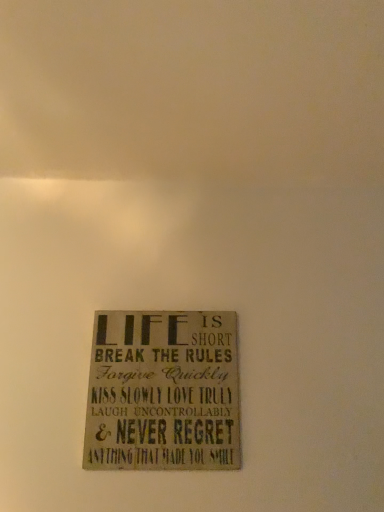
Looking at this image, what is the approximate height of wooden sign at lower center?

wooden sign at lower center is 12.20 inches in height.

Describe the element at coordinates (163, 392) in the screenshot. This screenshot has height=512, width=384. I see `wooden sign at lower center` at that location.

Identify the location of wooden sign at lower center. The image size is (384, 512). (163, 392).

What are the coordinates of `wooden sign at lower center` in the screenshot? It's located at (163, 392).